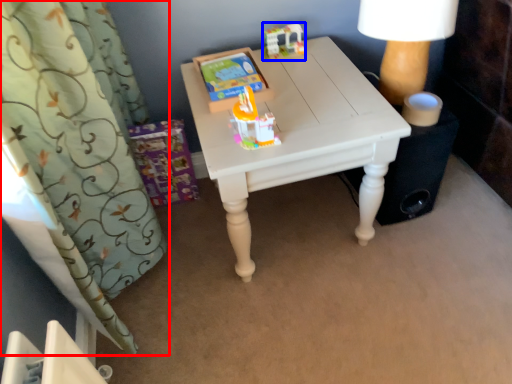
Question: Which object is closer to the camera taking this photo, curtain (highlighted by a red box) or toy (highlighted by a blue box)?

Choices:
 (A) curtain
 (B) toy

Answer: (A)